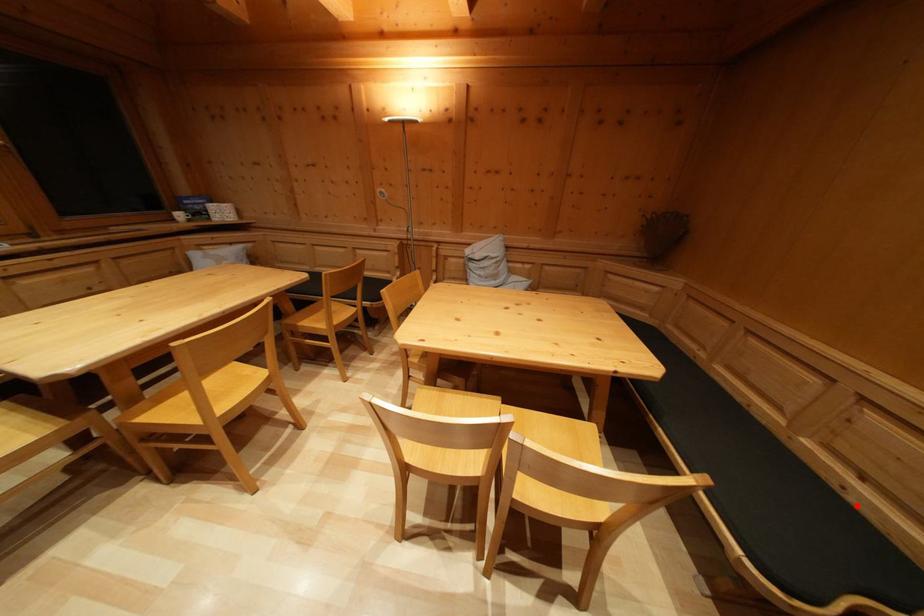
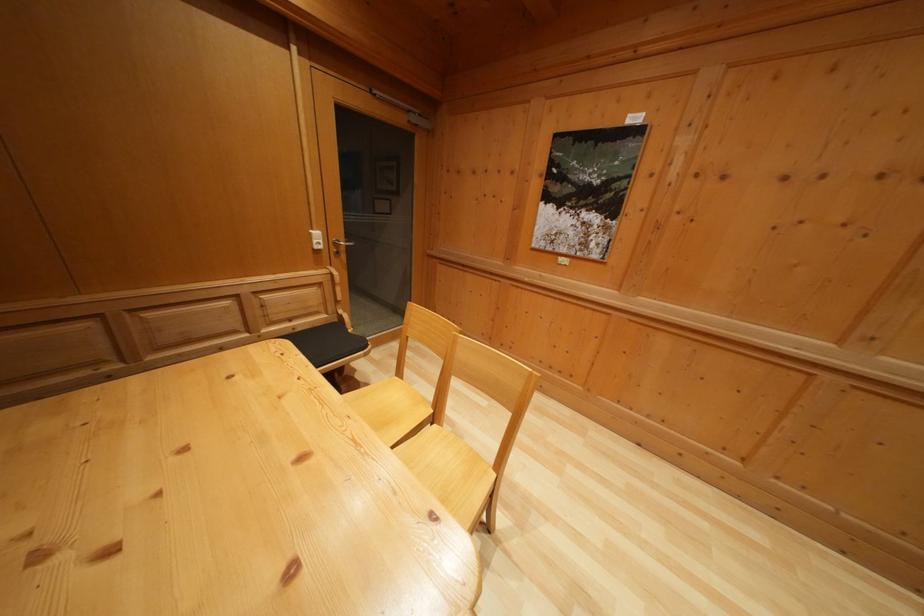
The point at the highlighted location is marked in the first image. Where is the corresponding point in the second image?

(305, 336)